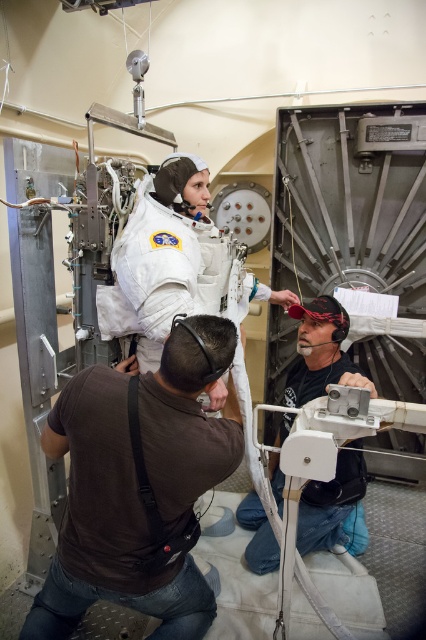
You are standing in the space simulation facility and want to reach a specific point marked at coordinates point (126, 573). If your reach extends 4 feet, can you touch that point without moving closer?

The distance of point (126, 573) from viewer is 4.24 feet, so you cannot touch it with a 4 feet reach since it is slightly farther away.

You are an astronaut in training and need to move from point A to point B. Point A is at coordinates point (173,388) and point B is at coordinates point (290,403). According to the scene, which point is closer to you as you face the scene?

Point (173,388) is in front of point (290,403), so Point A is closer to you as you face the scene.

You are an astronaut trainee observing the scene. You need to locate the brown fabric shirt at lower left and the matte black helmet at lower right. Which object is closer to the left edge of the image?

The brown fabric shirt at lower left is closer to the left edge of the image because it is positioned on the left side of the matte black helmet at lower right.